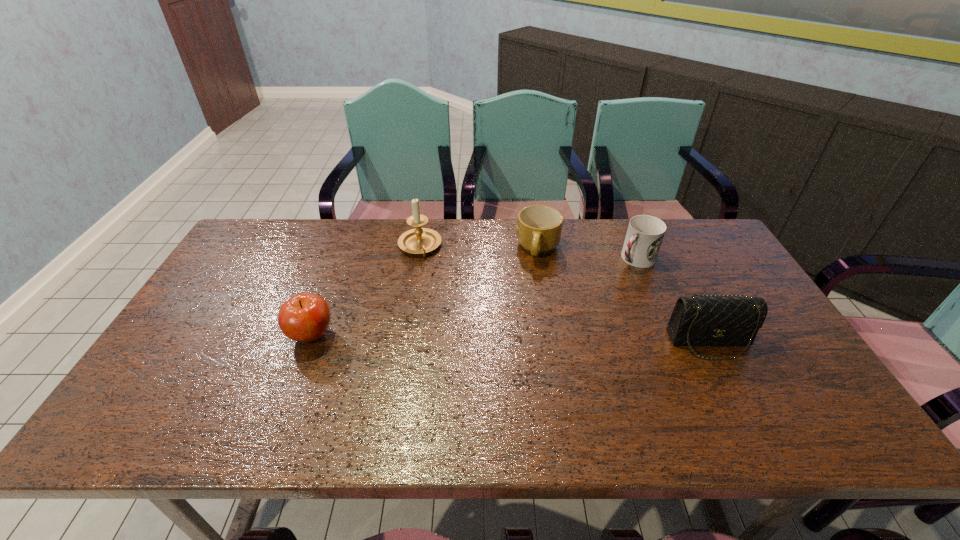
Find the location of a particular element. This screenshot has height=540, width=960. the leftmost object is located at coordinates (305, 317).

Where is `clutch bag`? Image resolution: width=960 pixels, height=540 pixels. clutch bag is located at coordinates (717, 320).

You are a GUI agent. You are given a task and a screenshot of the screen. Output one action in this format:
    pyautogui.click(x=<x>, y=<y>)
    Task: Click on the cup
    The height and width of the screenshot is (540, 960).
    Given the screenshot: What is the action you would take?
    pyautogui.click(x=645, y=233)

I want to click on candle holder, so click(420, 240).

Locate an element on the screen. The width and height of the screenshot is (960, 540). the fourth object from right to left is located at coordinates (420, 240).

The width and height of the screenshot is (960, 540). Identify the location of mug. (539, 227).

You are a GUI agent. You are given a task and a screenshot of the screen. Output one action in this format:
    pyautogui.click(x=<x>, y=<y>)
    Task: Click on the free spot located 0.210m on the back of the apple
    The height and width of the screenshot is (540, 960).
    Given the screenshot: What is the action you would take?
    pyautogui.click(x=337, y=269)

In order to click on vacant space located 0.090m on the front flap of the clutch bag in this screenshot , I will do `click(734, 392)`.

You are a GUI agent. You are given a task and a screenshot of the screen. Output one action in this format:
    pyautogui.click(x=<x>, y=<y>)
    Task: Click on the vacant area situated on the handle side of the cup
    
    Given the screenshot: What is the action you would take?
    pyautogui.click(x=605, y=285)

Where is `free spot located 0.400m on the handle side of the cup`? This screenshot has height=540, width=960. free spot located 0.400m on the handle side of the cup is located at coordinates (542, 336).